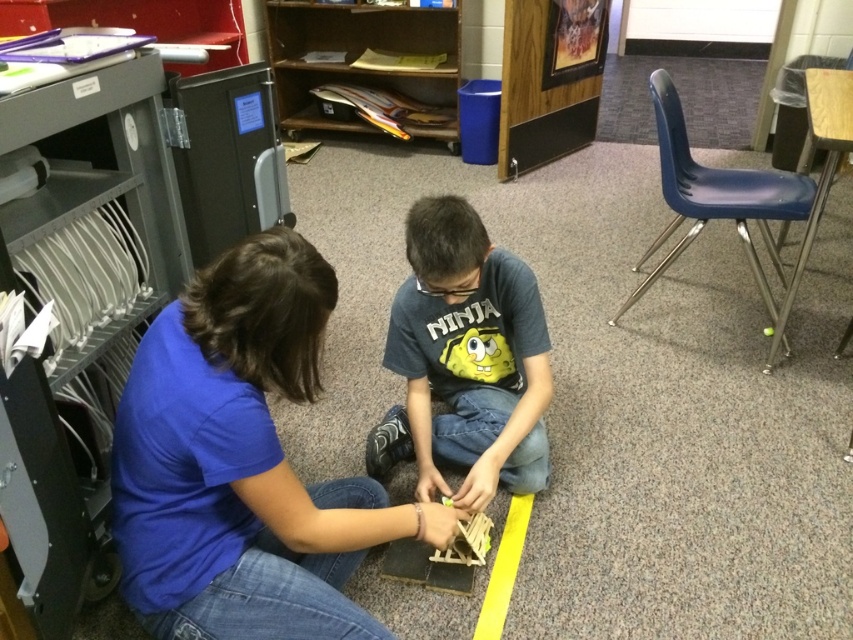
Question: Can you confirm if blue cotton shirt at center is positioned above gray matte shirt at center?

Choices:
 (A) yes
 (B) no

Answer: (B)

Question: Which point is farther from the camera taking this photo?

Choices:
 (A) (444, 529)
 (B) (511, 440)

Answer: (B)

Question: Which object is closer to the camera taking this photo?

Choices:
 (A) blue cotton shirt at center
 (B) gray matte shirt at center

Answer: (A)

Question: Does blue cotton shirt at center have a smaller size compared to gray matte shirt at center?

Choices:
 (A) no
 (B) yes

Answer: (B)

Question: Is blue cotton shirt at center bigger than gray matte shirt at center?

Choices:
 (A) no
 (B) yes

Answer: (A)

Question: Among these objects, which one is farthest from the camera?

Choices:
 (A) blue cotton shirt at center
 (B) gray matte shirt at center

Answer: (B)